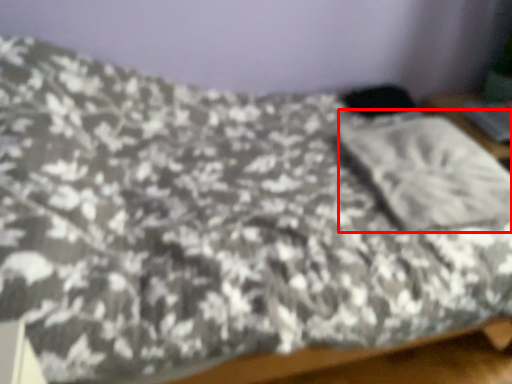
Question: From the image's perspective, what is the correct spatial relationship of pillow (annotated by the red box) in relation to silver?

Choices:
 (A) below
 (B) above

Answer: (A)